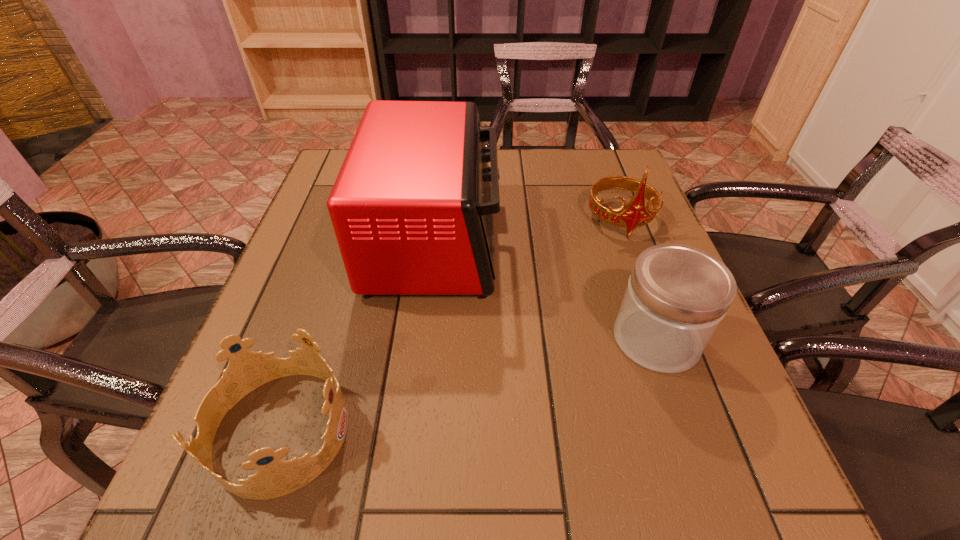
This screenshot has height=540, width=960. In order to click on toaster oven in this screenshot , I will do click(412, 207).

Find the location of a particular element. The image size is (960, 540). the right tiara is located at coordinates (636, 213).

You are a GUI agent. You are given a task and a screenshot of the screen. Output one action in this format:
    pyautogui.click(x=<x>, y=<y>)
    Task: Click on the farther tiara
    This screenshot has height=540, width=960.
    Given the screenshot: What is the action you would take?
    pyautogui.click(x=636, y=213)

At what (x,y) coordinates should I click in order to perform the action: click on the third tallest object. Please return your answer as a coordinate pair (x, y). Looking at the image, I should click on (676, 297).

This screenshot has height=540, width=960. I want to click on the nearer tiara, so click(x=247, y=370).

The width and height of the screenshot is (960, 540). Find the location of `the shortest object`. the shortest object is located at coordinates (247, 370).

The image size is (960, 540). Identify the location of vacant space located 0.070m on the front-facing side of the toaster oven. (531, 240).

Where is `vacant space located on the front-facing side of the right tiara`? This screenshot has width=960, height=540. vacant space located on the front-facing side of the right tiara is located at coordinates (x=659, y=323).

At what (x,y) coordinates should I click in order to perform the action: click on vacant position located 0.170m on the back of the jar. Please return your answer as a coordinate pair (x, y). Image resolution: width=960 pixels, height=540 pixels. Looking at the image, I should click on (626, 251).

At what (x,y) coordinates should I click in order to perform the action: click on free space located 0.220m on the front-facing side of the left tiara. Please return your answer as a coordinate pair (x, y). The height and width of the screenshot is (540, 960). Looking at the image, I should click on (486, 430).